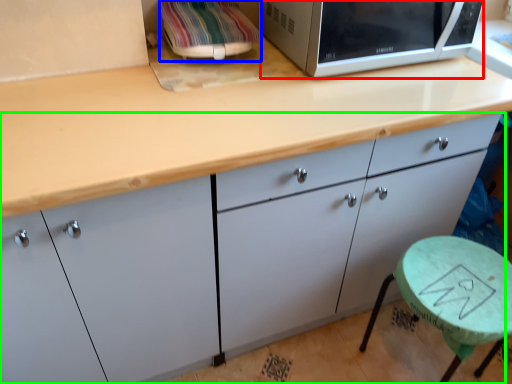
Question: Considering the real-world distances, which object is closest to microwave oven (highlighted by a red box)? appliance (highlighted by a blue box) or cabinetry (highlighted by a green box).

Choices:
 (A) appliance
 (B) cabinetry

Answer: (A)